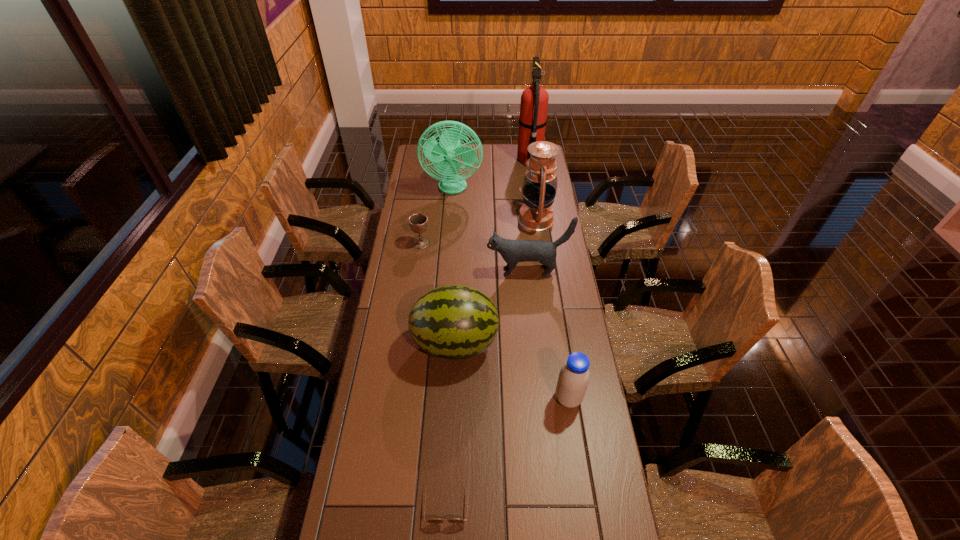
Where is `sunglasses`? The width and height of the screenshot is (960, 540). sunglasses is located at coordinates coord(433,520).

Find the location of a particular element. The width and height of the screenshot is (960, 540). vacant position located 0.320m at the nozzle of the farthest object is located at coordinates (458, 159).

Where is `free space located 0.200m at the nozzle of the farthest object`? This screenshot has height=540, width=960. free space located 0.200m at the nozzle of the farthest object is located at coordinates [480, 159].

This screenshot has width=960, height=540. Identify the location of free space located 0.080m at the nozzle of the farthest object. (502, 159).

Where is `vacant position located 0.100m in front of the fan to blow air`? vacant position located 0.100m in front of the fan to blow air is located at coordinates (451, 212).

Identify the location of blank space located on the left of the oil lamp. The image size is (960, 540). (x=431, y=220).

Find the location of a particular element. Image resolution: width=960 pixels, height=540 pixels. vacant space located at the face of the cat is located at coordinates (411, 272).

Identify the location of vacant space located 0.160m at the face of the cat. Image resolution: width=960 pixels, height=540 pixels. (447, 272).

At what (x,y) coordinates should I click in order to perform the action: click on free spot located at the face of the cat. Please return your answer as a coordinate pair (x, y). The height and width of the screenshot is (540, 960). Looking at the image, I should click on (452, 272).

Where is `vacant space located 0.170m at the stem end of the third nearest object`? This screenshot has width=960, height=540. vacant space located 0.170m at the stem end of the third nearest object is located at coordinates (546, 343).